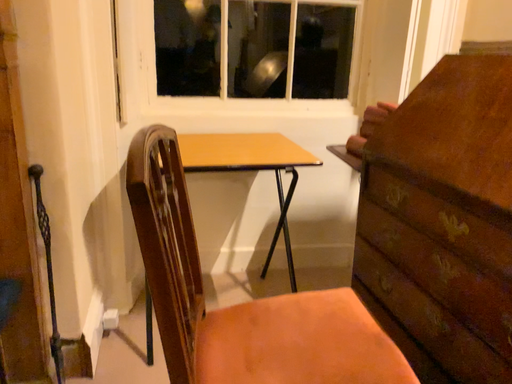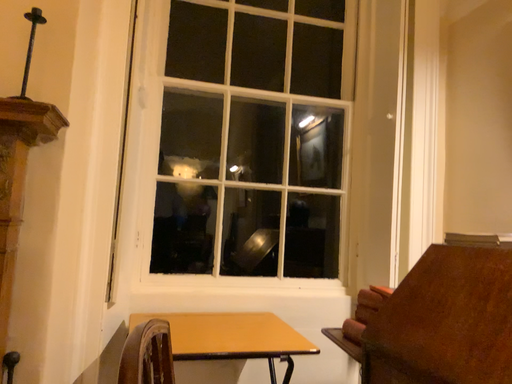
Question: Which way did the camera rotate in the video?

Choices:
 (A) rotated upward
 (B) rotated downward

Answer: (A)